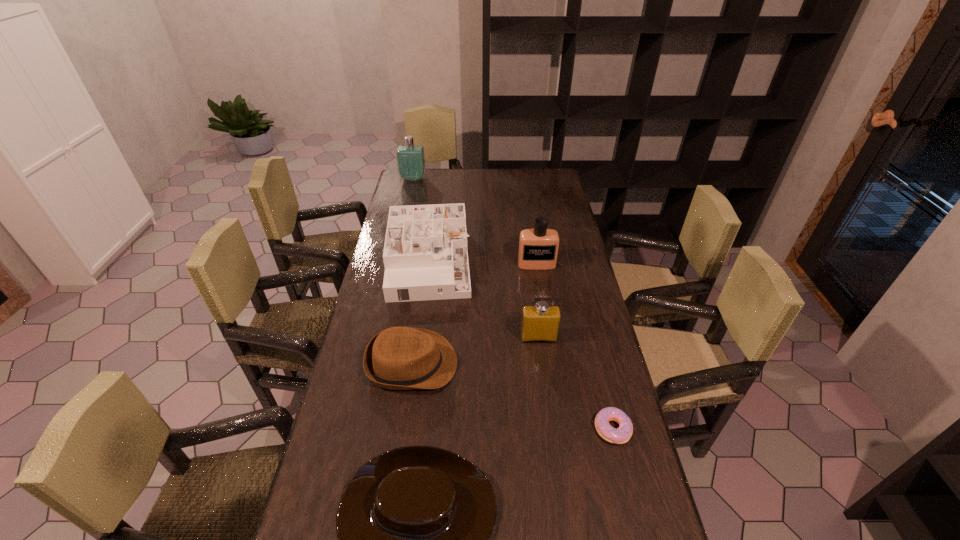
Locate which object ranks second in proximity to the farthest object. Please provide its 2D coordinates. Your answer should be formatted as a tuple, i.e. [(x, y)], where the tuple contains the x and y coordinates of a point satisfying the conditions above.

[(538, 248)]

Locate which object is the fourth closest to the farthest perfume. Please provide its 2D coordinates. Your answer should be formatted as a tuple, i.e. [(x, y)], where the tuple contains the x and y coordinates of a point satisfying the conditions above.

[(540, 323)]

Image resolution: width=960 pixels, height=540 pixels. Identify the location of perfume that stands as the second closest to the farthest perfume. (540, 323).

Where is `perfume that is the third closest one to the rightmost object`? The height and width of the screenshot is (540, 960). perfume that is the third closest one to the rightmost object is located at coordinates (411, 163).

The width and height of the screenshot is (960, 540). What are the coordinates of `free space that satisfies the following two spatial constraints: 1. on the front-facing side of the sixth farthest object; 2. on the right side of the fedora` in the screenshot? It's located at (402, 429).

The image size is (960, 540). In order to click on vacant position in the image that satisfies the following two spatial constraints: 1. on the front-facing side of the fedora; 2. on the left side of the sixth farthest object in this screenshot , I will do [x=402, y=429].